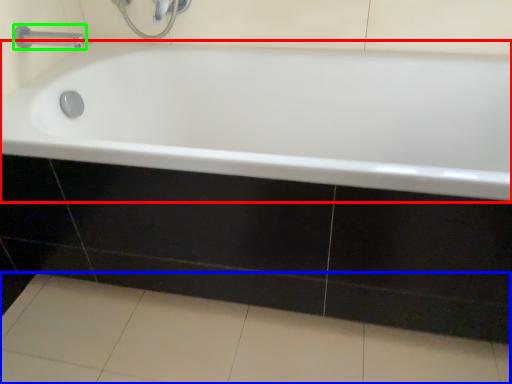
Question: Which is nearer to the bathtub (highlighted by a red box)? ceramic tile (highlighted by a blue box) or tap (highlighted by a green box).

Choices:
 (A) ceramic tile
 (B) tap

Answer: (A)